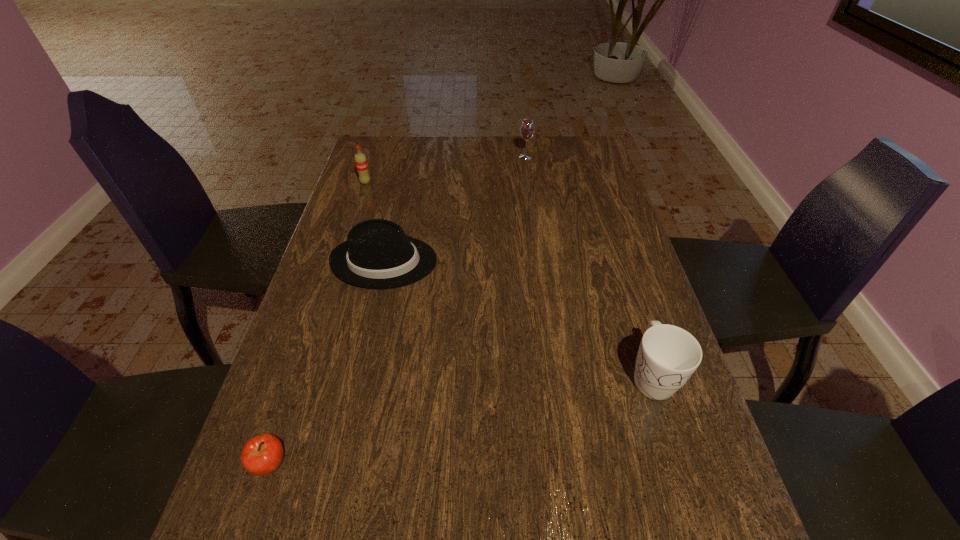
What are the coordinates of `blank area located on the right of the soda` in the screenshot? It's located at (487, 183).

Where is `vacant space positioned on the side of the second nearest object with the handle`? The height and width of the screenshot is (540, 960). vacant space positioned on the side of the second nearest object with the handle is located at coordinates (702, 537).

Find the location of a particular element. vacant space located 0.330m on the front-facing side of the fedora is located at coordinates (560, 261).

At what (x,y) coordinates should I click in order to perform the action: click on vacant area situated on the right of the shortest object. Please return your answer as a coordinate pair (x, y). Looking at the image, I should click on [349, 464].

Locate an element on the screen. The image size is (960, 540). object at the far edge is located at coordinates (527, 129).

Locate an element on the screen. The image size is (960, 540). soda located in the left edge section of the desktop is located at coordinates (361, 163).

I want to click on fedora situated at the left edge, so click(x=377, y=254).

Locate an element on the screen. apple positioned at the left edge is located at coordinates (262, 455).

Identify the location of object located at the right edge. (668, 355).

Find the location of a particular element. The height and width of the screenshot is (540, 960). vacant space at the left edge of the desktop is located at coordinates (331, 420).